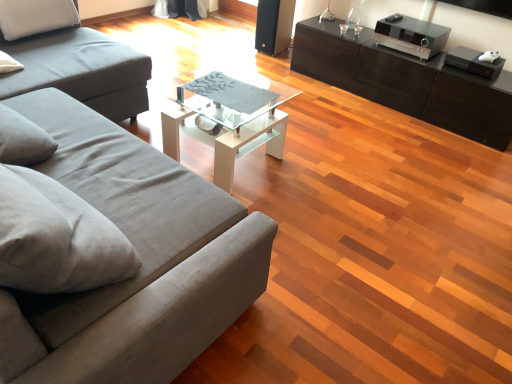
What do you see at coordinates (80, 70) in the screenshot? I see `matte gray fabric studio couch at left, arranged as the 2th studio couch when viewed from the front` at bounding box center [80, 70].

Measure the distance between gray fabric couch at left, the first studio couch when ordered from front to back, and camera.

The distance of gray fabric couch at left, the first studio couch when ordered from front to back, from camera is 35.58 inches.

Image resolution: width=512 pixels, height=384 pixels. I want to click on black glossy cabinet at right, so click(406, 82).

Which is correct: gray fabric couch at left, the second studio couch positioned from the back, is inside matte gray fabric studio couch at left, arranged as the 1th studio couch when viewed from the back, or outside of it?

gray fabric couch at left, the second studio couch positioned from the back, cannot be found inside matte gray fabric studio couch at left, arranged as the 1th studio couch when viewed from the back.

Is gray fabric couch at left, the second studio couch positioned from the back, to the right of matte gray fabric studio couch at left, arranged as the 1th studio couch when viewed from the back, from the viewer's perspective?

Correct, you'll find gray fabric couch at left, the second studio couch positioned from the back, to the right of matte gray fabric studio couch at left, arranged as the 1th studio couch when viewed from the back.

Is gray fabric couch at left, the second studio couch positioned from the back, in contact with matte gray fabric studio couch at left, arranged as the 2th studio couch when viewed from the front?

gray fabric couch at left, the second studio couch positioned from the back, and matte gray fabric studio couch at left, arranged as the 2th studio couch when viewed from the front, are clearly separated.

From the image's perspective, who appears lower, gray fabric couch at left, the first studio couch when ordered from front to back, or matte gray fabric studio couch at left, arranged as the 1th studio couch when viewed from the back?

gray fabric couch at left, the first studio couch when ordered from front to back.

Is point (305, 70) closer or farther from the camera than point (181, 86)?

Point (305, 70).

Is the surface of black glossy cabinet at right in direct contact with clear glass coffee table at center?

black glossy cabinet at right is not next to clear glass coffee table at center, and they're not touching.

Considering the positions of objects black glossy cabinet at right and clear glass coffee table at center in the image provided, who is more to the left, black glossy cabinet at right or clear glass coffee table at center?

clear glass coffee table at center.

Is clear glass coffee table at center inside black glossy cabinet at right?

No, clear glass coffee table at center is located outside of black glossy cabinet at right.

In the scene shown: Could you tell me if matte gray fabric studio couch at left, arranged as the 2th studio couch when viewed from the front, is turned towards black glossy cabinet at right?

No, matte gray fabric studio couch at left, arranged as the 2th studio couch when viewed from the front, is not facing towards black glossy cabinet at right.

From the image's perspective, is matte gray fabric studio couch at left, arranged as the 1th studio couch when viewed from the back, above or below black glossy cabinet at right?

Based on their image positions, matte gray fabric studio couch at left, arranged as the 1th studio couch when viewed from the back, is located beneath black glossy cabinet at right.

Who is bigger, matte gray fabric studio couch at left, arranged as the 2th studio couch when viewed from the front, or black glossy cabinet at right?

matte gray fabric studio couch at left, arranged as the 2th studio couch when viewed from the front, is bigger.

Relative to black glossy cabinet at right, is clear glass coffee table at center in front or behind?

clear glass coffee table at center is positioned closer to the viewer than black glossy cabinet at right.

In the scene shown: From the image's perspective, relative to black glossy cabinet at right, is clear glass coffee table at center above or below?

Clearly, from the image's perspective, clear glass coffee table at center is below black glossy cabinet at right.

Looking at their sizes, would you say clear glass coffee table at center is wider or thinner than black glossy cabinet at right?

clear glass coffee table at center is wider than black glossy cabinet at right.

Considering the relative positions of black glossy cabinet at right and matte gray fabric studio couch at left, arranged as the 2th studio couch when viewed from the front, in the image provided, is black glossy cabinet at right to the right of matte gray fabric studio couch at left, arranged as the 2th studio couch when viewed from the front, from the viewer's perspective?

Correct, you'll find black glossy cabinet at right to the right of matte gray fabric studio couch at left, arranged as the 2th studio couch when viewed from the front.

Does black glossy cabinet at right touch matte gray fabric studio couch at left, arranged as the 1th studio couch when viewed from the back?

There is a gap between black glossy cabinet at right and matte gray fabric studio couch at left, arranged as the 1th studio couch when viewed from the back.

Who is taller, black glossy cabinet at right or matte gray fabric studio couch at left, arranged as the 2th studio couch when viewed from the front?

matte gray fabric studio couch at left, arranged as the 2th studio couch when viewed from the front.

Is black glossy cabinet at right at the left side of gray fabric couch at left, the first studio couch when ordered from front to back?

No.

Which is closer to the camera, (307, 28) or (160, 164)?

The point (160, 164) is in front.

From the image's perspective, is black glossy cabinet at right above or below gray fabric couch at left, the second studio couch positioned from the back?

black glossy cabinet at right is above gray fabric couch at left, the second studio couch positioned from the back.

Identify the location of table on the right of gray fabric couch at left, the first studio couch when ordered from front to back. (406, 82).

Consider the image. How far apart are gray fabric couch at left, the first studio couch when ordered from front to back, and black glossy cabinet at right?

The distance of gray fabric couch at left, the first studio couch when ordered from front to back, from black glossy cabinet at right is 7.49 feet.

From a real-world perspective, is gray fabric couch at left, the first studio couch when ordered from front to back, positioned above or below black glossy cabinet at right?

From a real-world perspective, gray fabric couch at left, the first studio couch when ordered from front to back, is physically above black glossy cabinet at right.

Can you tell me how much gray fabric couch at left, the second studio couch positioned from the back, and black glossy cabinet at right differ in facing direction?

gray fabric couch at left, the second studio couch positioned from the back, and black glossy cabinet at right are facing 179 degrees away from each other.

In the image, there is a matte gray fabric studio couch at left, arranged as the 2th studio couch when viewed from the front. Where is `studio couch below it (from the image's perspective)`? This screenshot has width=512, height=384. studio couch below it (from the image's perspective) is located at coordinates (139, 256).

I want to click on table that appears above the clear glass coffee table at center (from the image's perspective), so click(x=406, y=82).

Which object lies further to the anchor point black glossy cabinet at right, clear glass coffee table at center or matte gray fabric studio couch at left, arranged as the 2th studio couch when viewed from the front?

The object further to black glossy cabinet at right is matte gray fabric studio couch at left, arranged as the 2th studio couch when viewed from the front.

From the picture: Considering their positions, is gray fabric couch at left, the second studio couch positioned from the back, positioned closer to clear glass coffee table at center than black glossy cabinet at right?

Among the two, gray fabric couch at left, the second studio couch positioned from the back, is located nearer to clear glass coffee table at center.

From the image, which object appears to be nearer to gray fabric couch at left, the second studio couch positioned from the back, black glossy cabinet at right or matte gray fabric studio couch at left, arranged as the 2th studio couch when viewed from the front?

matte gray fabric studio couch at left, arranged as the 2th studio couch when viewed from the front, lies closer to gray fabric couch at left, the second studio couch positioned from the back, than the other object.

Estimate the real-world distances between objects in this image. Which object is further from clear glass coffee table at center, matte gray fabric studio couch at left, arranged as the 1th studio couch when viewed from the back, or black glossy cabinet at right?

The object further to clear glass coffee table at center is black glossy cabinet at right.

Looking at the image, which one is located further to clear glass coffee table at center, gray fabric couch at left, the first studio couch when ordered from front to back, or matte gray fabric studio couch at left, arranged as the 1th studio couch when viewed from the back?

Among the two, gray fabric couch at left, the first studio couch when ordered from front to back, is located further to clear glass coffee table at center.

Looking at the image, which one is located further to black glossy cabinet at right, gray fabric couch at left, the second studio couch positioned from the back, or matte gray fabric studio couch at left, arranged as the 2th studio couch when viewed from the front?

gray fabric couch at left, the second studio couch positioned from the back.

Based on the photo, when comparing their distances from matte gray fabric studio couch at left, arranged as the 1th studio couch when viewed from the back, does gray fabric couch at left, the first studio couch when ordered from front to back, or black glossy cabinet at right seem closer?

Among the two, gray fabric couch at left, the first studio couch when ordered from front to back, is located nearer to matte gray fabric studio couch at left, arranged as the 1th studio couch when viewed from the back.

Considering their positions, is gray fabric couch at left, the first studio couch when ordered from front to back, positioned further to matte gray fabric studio couch at left, arranged as the 1th studio couch when viewed from the back, than clear glass coffee table at center?

gray fabric couch at left, the first studio couch when ordered from front to back.

This screenshot has height=384, width=512. Find the location of `studio couch located between matte gray fabric studio couch at left, arranged as the 1th studio couch when viewed from the back, and black glossy cabinet at right in the left-right direction`. studio couch located between matte gray fabric studio couch at left, arranged as the 1th studio couch when viewed from the back, and black glossy cabinet at right in the left-right direction is located at coordinates (139, 256).

This screenshot has width=512, height=384. Identify the location of coffee table between matte gray fabric studio couch at left, arranged as the 2th studio couch when viewed from the front, and black glossy cabinet at right. (228, 118).

You are a GUI agent. You are given a task and a screenshot of the screen. Output one action in this format:
    pyautogui.click(x=<x>, y=<y>)
    Task: Click on the studio couch positioned between gray fabric couch at left, the second studio couch positioned from the back, and clear glass coffee table at center from near to far
    The height and width of the screenshot is (384, 512).
    Given the screenshot: What is the action you would take?
    pyautogui.click(x=80, y=70)

The height and width of the screenshot is (384, 512). I want to click on coffee table between gray fabric couch at left, the first studio couch when ordered from front to back, and black glossy cabinet at right from front to back, so click(x=228, y=118).